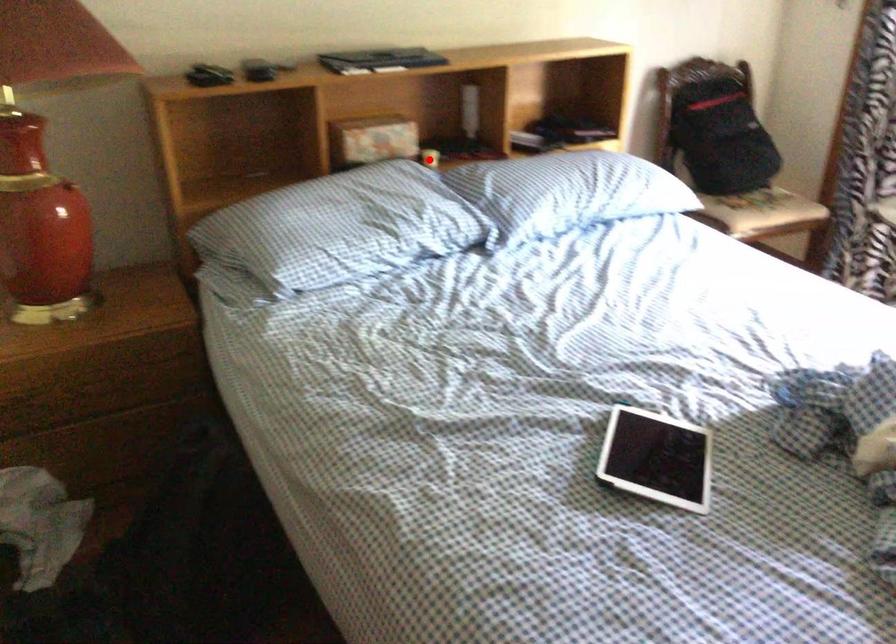
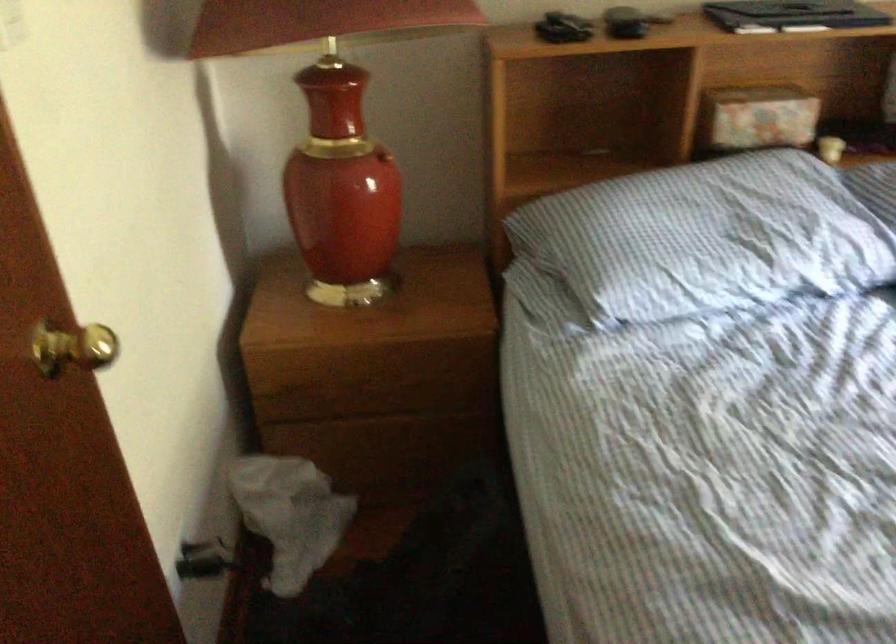
Question: I am providing you with two images of the same scene from different viewpoints. Given a red point in image1, look at the same physical point in image2. Is it:

Choices:
 (A) Closer to the viewpoint
 (B) Farther from the viewpoint

Answer: (A)